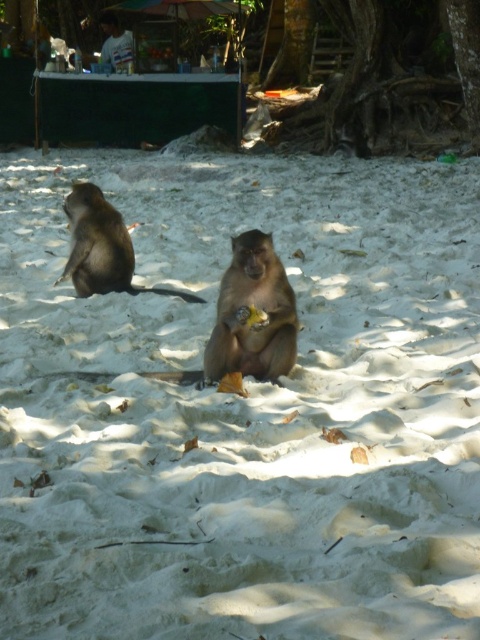
You are standing on the beach and see two points marked on the sand. The first point is at coordinates point (x=312, y=8) and the second is at point (x=252, y=368). If you want to walk towards both points, which one will you reach first?

You will reach point (x=312, y=8) first because it is closer to you than point (x=252, y=368), which is further away.

You are standing on the beach and want to take a photo of both the brown furry monkey at center and the brown furry monkey at left. Which monkey should you focus on first to ensure both are in the frame?

You should focus on the brown furry monkey at left first because it is farther away from you than the brown furry monkey at center, ensuring both are in the frame.

Looking at this image, you are a photographer trying to capture both monkeys in a single frame. Since the brown furry monkey at center is shorter than the brown furry monkey at left, which monkey should you position closer to the camera to ensure both are fully visible in the photo?

To ensure both the brown furry monkey at center and the brown furry monkey at left are fully visible in the photo, you should position the brown furry monkey at center closer to the camera since it is shorter than the brown furry monkey at left.